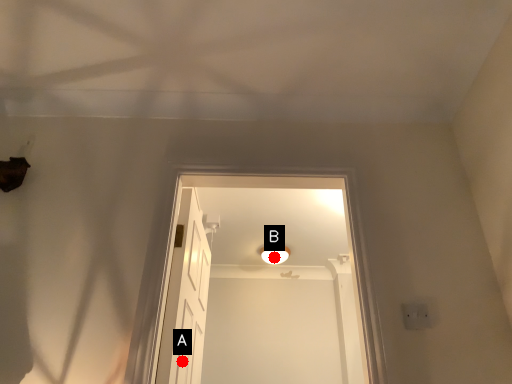
Question: Two points are circled on the image, labeled by A and B beside each circle. Which point is farther from the camera taking this photo?

Choices:
 (A) A is further
 (B) B is further

Answer: (B)